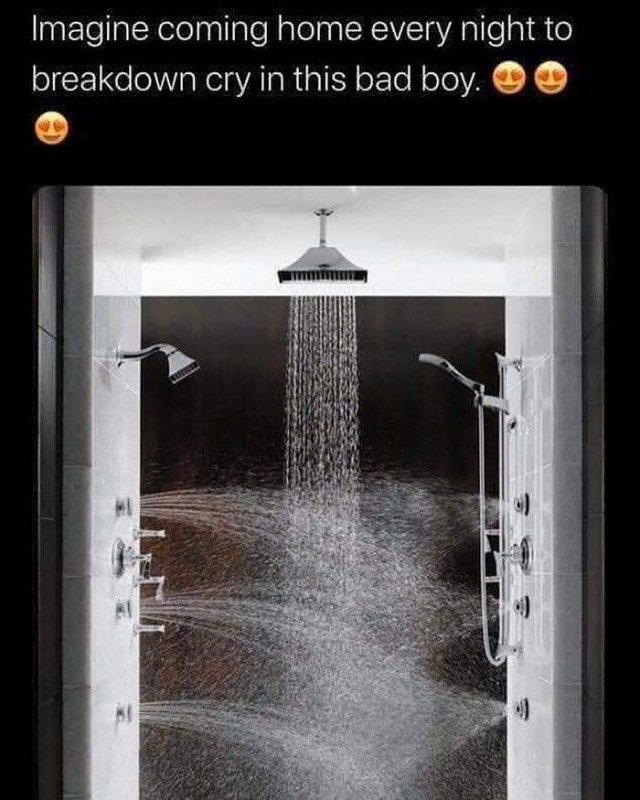
The width and height of the screenshot is (640, 800). Identify the location of ceiling. (372, 221).